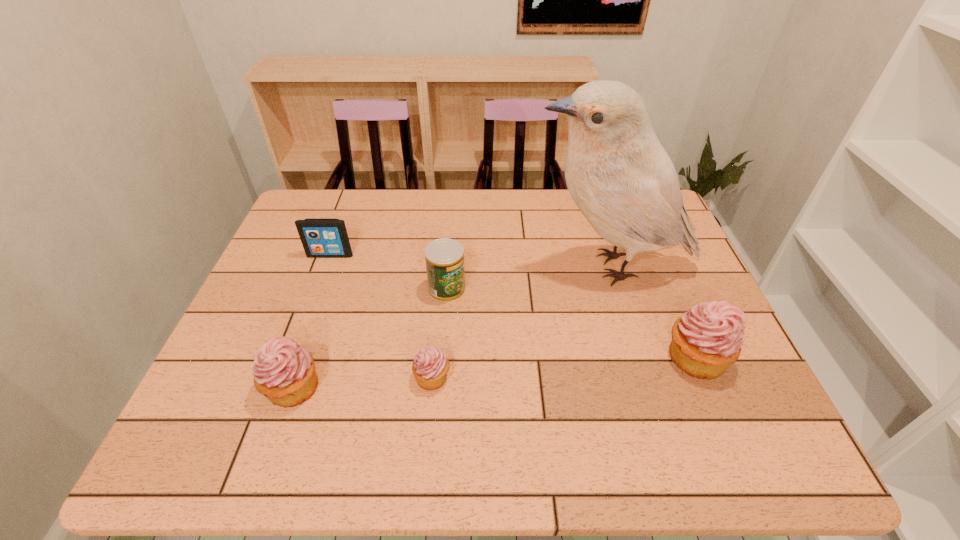
In order to click on vacant spot for a new cupcake to ensure equal spacing in this screenshot , I will do `click(566, 367)`.